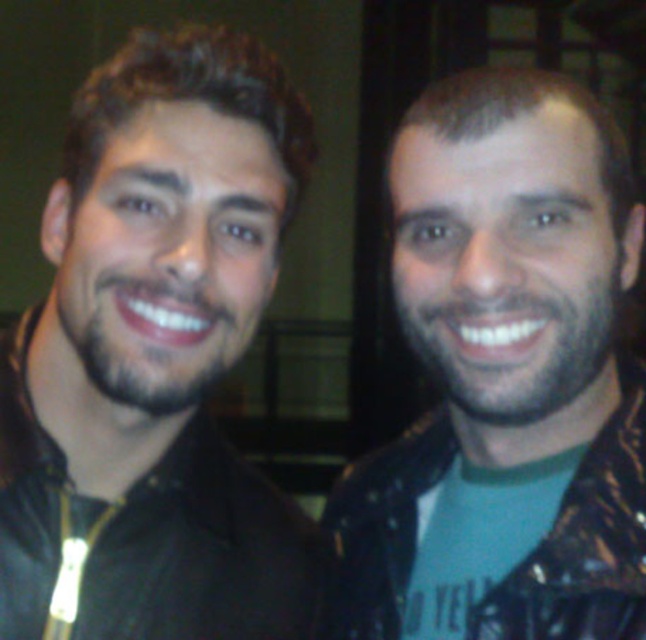
Question: Is black leather jacket at left below leather jacket at right?

Choices:
 (A) no
 (B) yes

Answer: (A)

Question: Does black leather jacket at left appear on the left side of leather jacket at right?

Choices:
 (A) yes
 (B) no

Answer: (A)

Question: Which point is farther to the camera?

Choices:
 (A) black leather jacket at left
 (B) leather jacket at right

Answer: (A)

Question: Is the position of black leather jacket at left less distant than that of leather jacket at right?

Choices:
 (A) no
 (B) yes

Answer: (A)